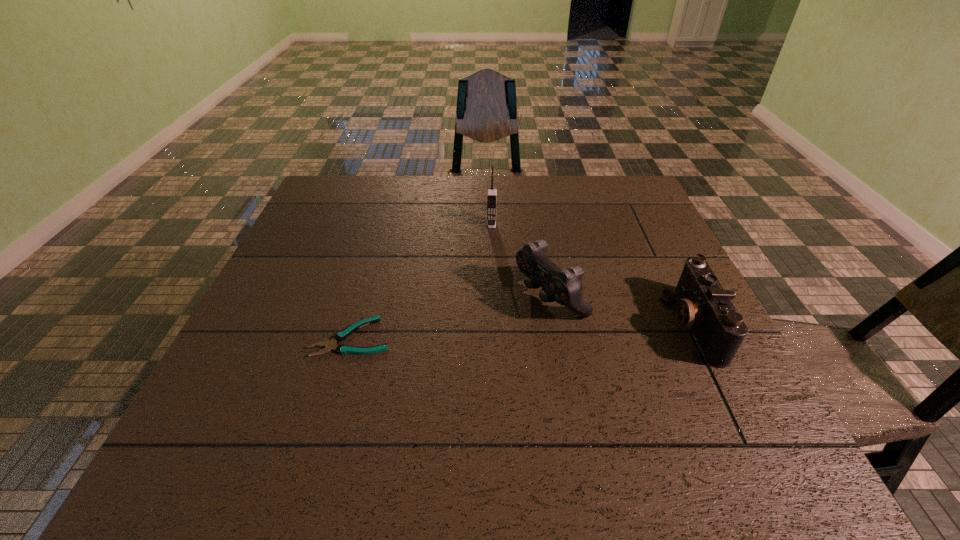
I want to click on vacant space that satisfies the following two spatial constraints: 1. on the front side of the rightmost object; 2. on the front-facing side of the farthest object, so click(x=495, y=325).